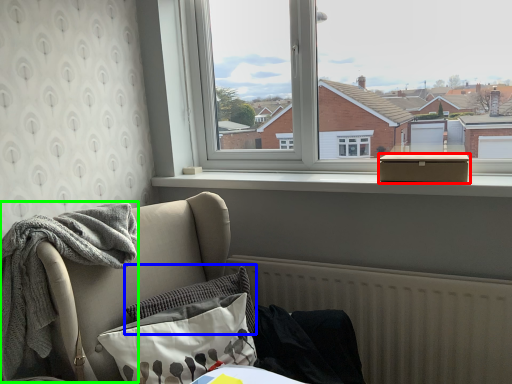
Question: Which object is positioned farthest from box (highlighted by a red box)? Select from pillow (highlighted by a blue box) and material (highlighted by a green box).

Choices:
 (A) pillow
 (B) material

Answer: (B)